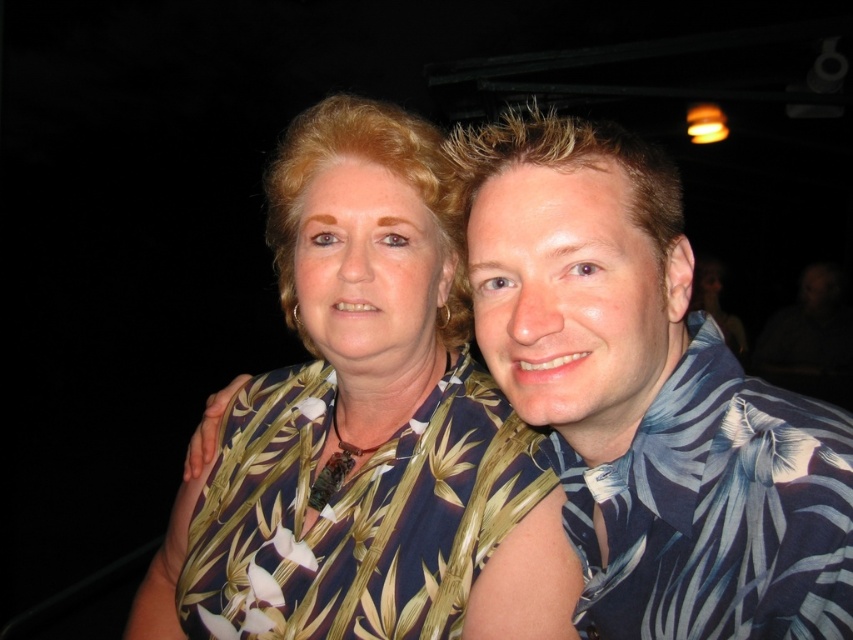
Does printed fabric blouse at center have a lesser width compared to blue floral shirt at right?

Incorrect, printed fabric blouse at center's width is not less than blue floral shirt at right's.

The height and width of the screenshot is (640, 853). I want to click on printed fabric blouse at center, so click(364, 428).

Where is `printed fabric blouse at center`? printed fabric blouse at center is located at coordinates (x=364, y=428).

Who is more forward, (201,465) or (822,420)?

Point (822,420) is more forward.

Can you confirm if printed fabric blouse at center is positioned to the right of blue floral shirt at center?

In fact, printed fabric blouse at center is to the left of blue floral shirt at center.

Which is in front, point (469, 442) or point (683, 496)?

Positioned in front is point (683, 496).

You are a GUI agent. You are given a task and a screenshot of the screen. Output one action in this format:
    pyautogui.click(x=<x>, y=<y>)
    Task: Click on the printed fabric blouse at center
    This screenshot has width=853, height=640.
    Given the screenshot: What is the action you would take?
    pyautogui.click(x=364, y=428)

Between blue floral shirt at right and blue floral shirt at center, which one is positioned higher?

blue floral shirt at right is above.

Which is more to the left, blue floral shirt at right or blue floral shirt at center?

Positioned to the left is blue floral shirt at right.

I want to click on blue floral shirt at right, so click(648, 397).

This screenshot has width=853, height=640. In order to click on blue floral shirt at right in this screenshot , I will do `click(648, 397)`.